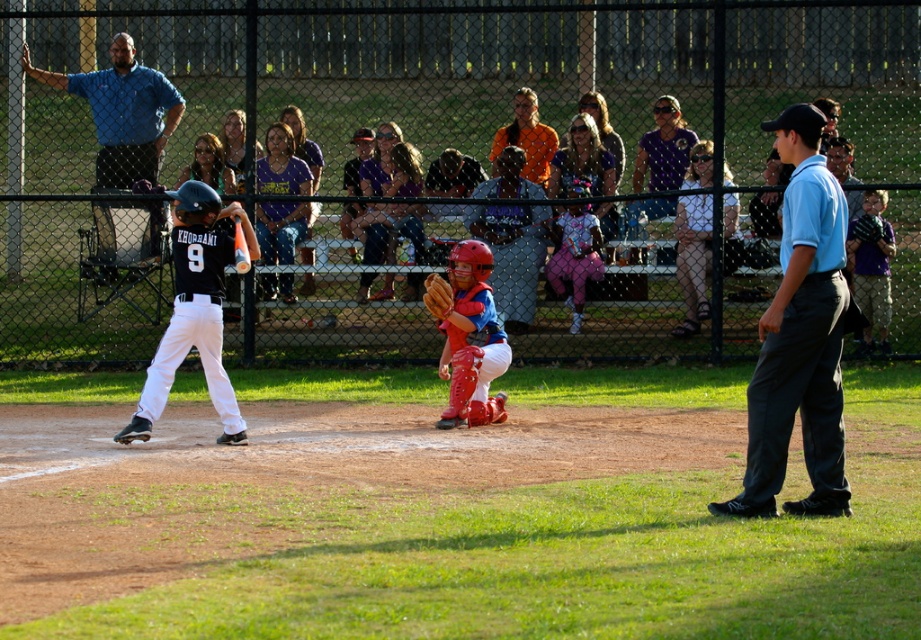
What is the color of the shirt worn by the player located at the coordinates point [800,337]?

The point [800,337] indicates a light blue shirt at right.

You are a coach observing the baseball game. You notice the light blue shirt at right and the brown leather glove at center. How far apart are these two items in meters?

The light blue shirt at right and the brown leather glove at center are 3.60 meters apart.